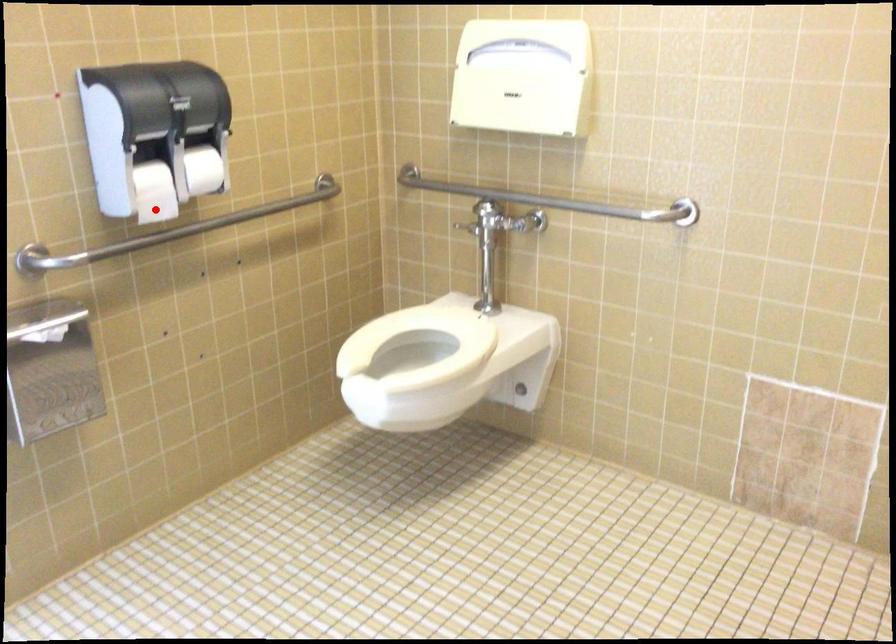
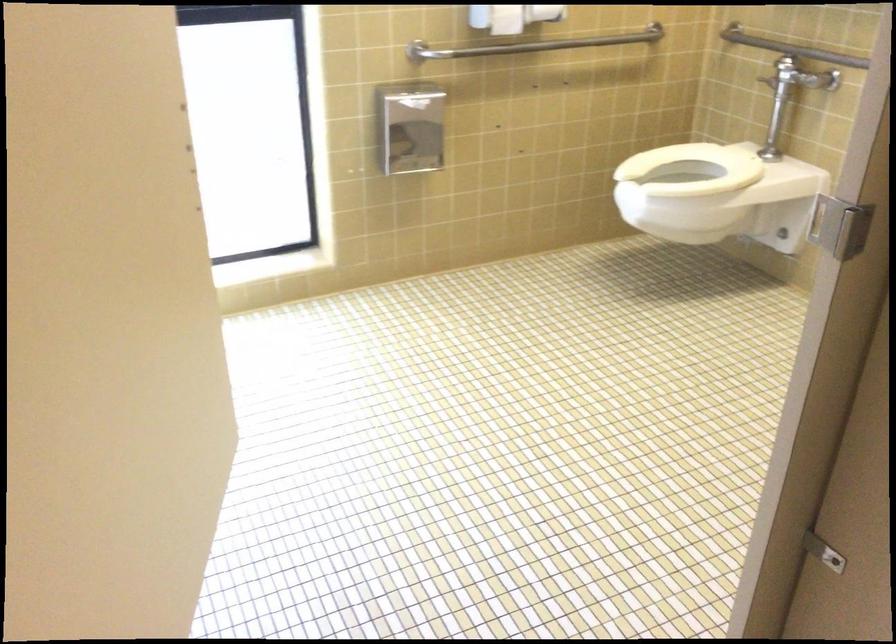
Question: I am providing you with two images of the same scene from different viewpoints. Image1 has a red point marked. In image2, the corresponding 3D location appears at what relative position? Reply with the corresponding letter.

Choices:
 (A) Closer
 (B) Farther

Answer: (B)